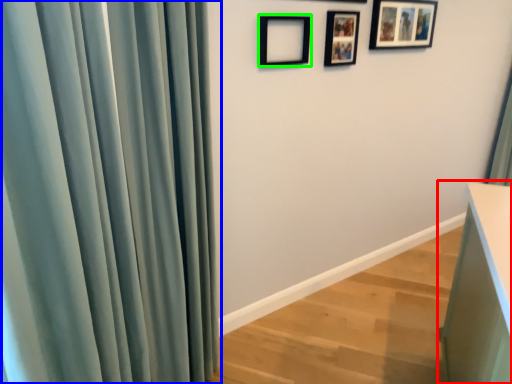
Question: Based on their relative distances, which object is farther from vanity (highlighted by a red box)? Choose from curtain (highlighted by a blue box) and picture frame (highlighted by a green box).

Choices:
 (A) curtain
 (B) picture frame

Answer: (B)